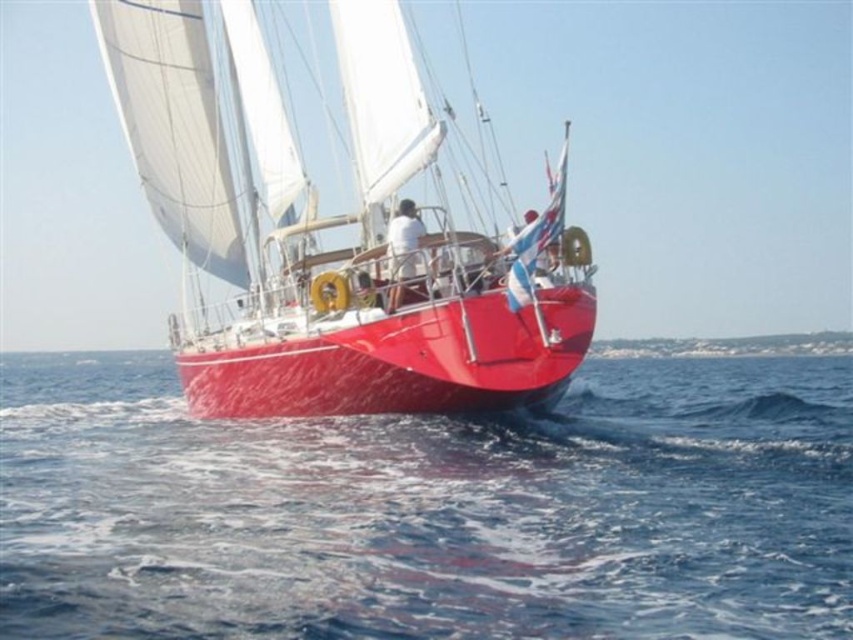
Question: Which point is farther to the camera?

Choices:
 (A) coord(123,518)
 (B) coord(171,198)

Answer: (B)

Question: Which point is closer to the camera?

Choices:
 (A) blue water at lower center
 (B) shiny red sailboat at center

Answer: (A)

Question: In this image, where is blue water at lower center located relative to shiny red sailboat at center?

Choices:
 (A) left
 (B) right

Answer: (B)

Question: Is blue water at lower center below shiny red sailboat at center?

Choices:
 (A) yes
 (B) no

Answer: (A)

Question: From the image, what is the correct spatial relationship of blue water at lower center in relation to shiny red sailboat at center?

Choices:
 (A) above
 (B) below

Answer: (B)